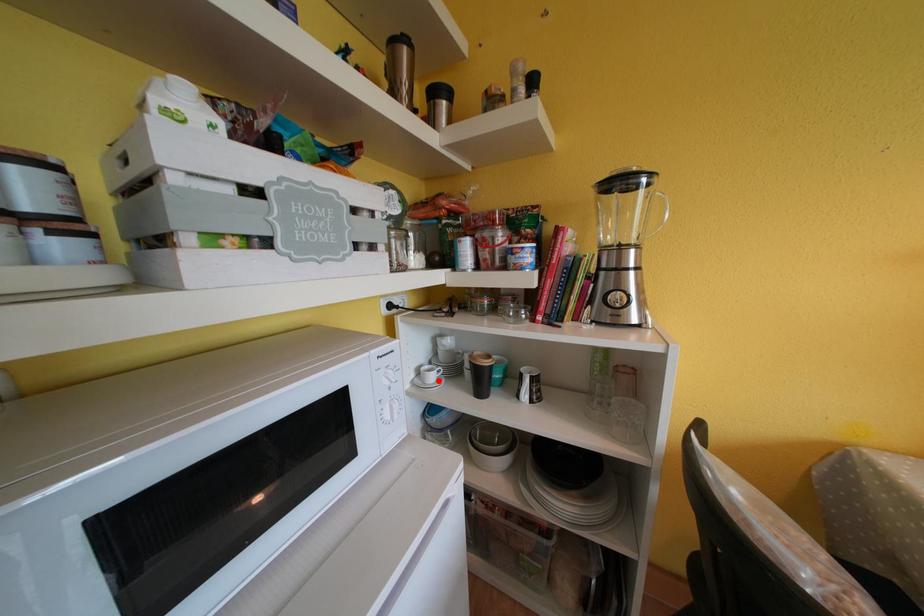
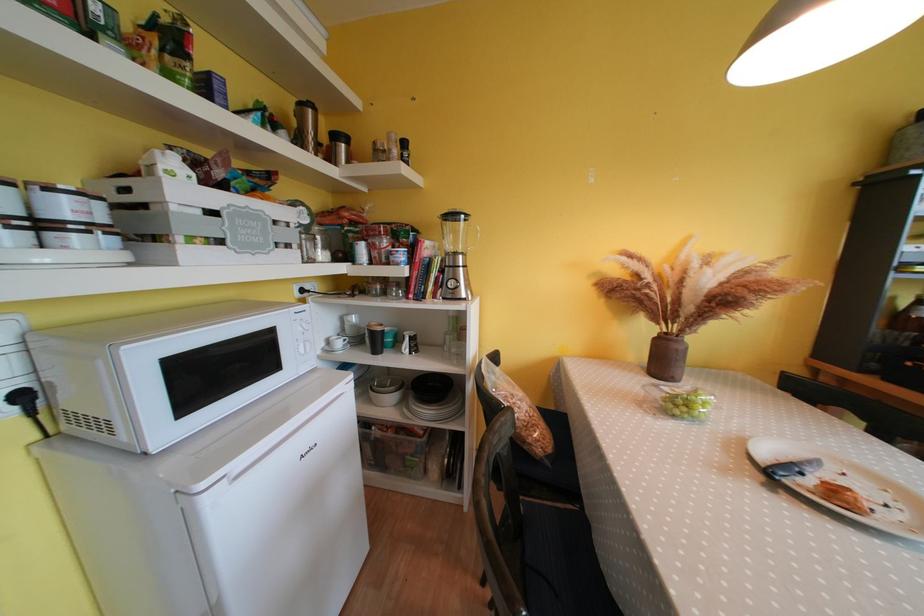
Where in the second image is the point corresponding to the highlighted location from the first image?

(345, 347)